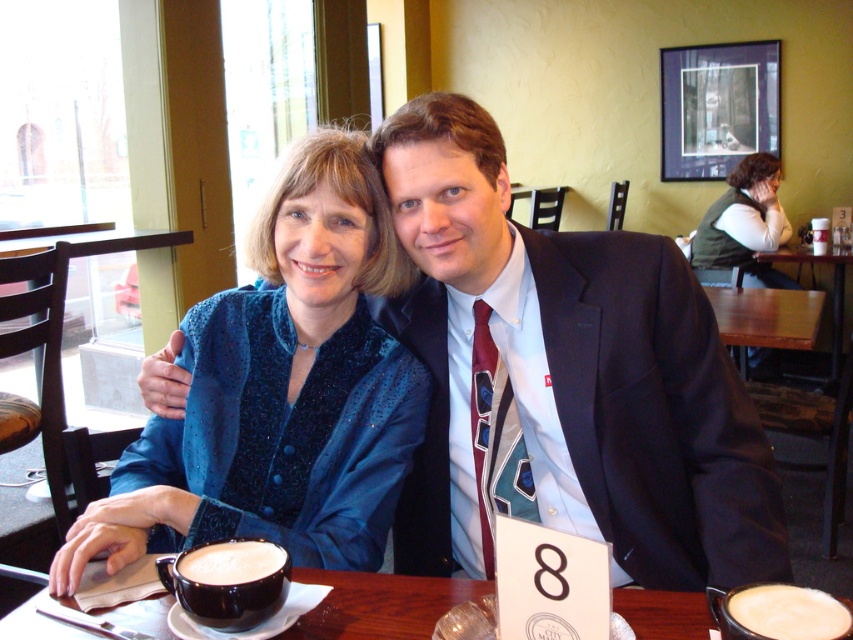
Question: Is green textured vest at upper right positioned behind white frothy foam at lower left?

Choices:
 (A) no
 (B) yes

Answer: (B)

Question: Which point is closer to the camera?

Choices:
 (A) (412, 173)
 (B) (202, 557)
 (C) (836, 260)
 (D) (231, 609)

Answer: (D)

Question: Does white frothy beverage at table right have a smaller size compared to wooden table at center?

Choices:
 (A) yes
 (B) no

Answer: (A)

Question: Which point appears farthest from the camera in this image?

Choices:
 (A) (624, 417)
 (B) (146, 621)
 (C) (730, 182)
 (D) (346, 456)

Answer: (C)

Question: Which of these objects is positioned farthest from the brown wooden table at center?

Choices:
 (A) white frothy beverage at table right
 (B) green textured vest at upper right

Answer: (B)

Question: Can you confirm if matte black suit at center is positioned to the left of white frothy beverage at lower left?

Choices:
 (A) yes
 (B) no

Answer: (B)